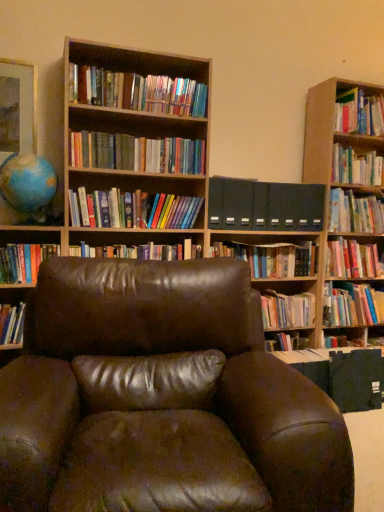
You are a GUI agent. You are given a task and a screenshot of the screen. Output one action in this format:
    pyautogui.click(x=<x>, y=<y>)
    Task: Click on the hardcover book at center, arranged as the fifth book when ordered from the bottom
    
    Given the screenshot: What is the action you would take?
    pyautogui.click(x=272, y=258)

Describe the element at coordinates (137, 92) in the screenshot. I see `hardcover books at upper center, the 12th book ordered from the bottom` at that location.

What is the approximate width of hardcover books at upper center, arranged as the second book when viewed from the top?

It is 8.76 inches.

How much space does hardcover books at center, marked as the 7th book in a bottom-to-top arrangement, occupy vertically?

hardcover books at center, marked as the 7th book in a bottom-to-top arrangement, is 6.47 inches in height.

What is the approximate width of hardcover books at center, marked as the 7th book in a bottom-to-top arrangement?

8.76 inches.

The height and width of the screenshot is (512, 384). What do you see at coordinates (265, 205) in the screenshot? I see `dark gray matte folder at center` at bounding box center [265, 205].

This screenshot has width=384, height=512. Identify the location of hardcover book at right, the sixth book in the bottom-to-top sequence. (352, 259).

From the image's perspective, is hardcover book at upper right, acting as the 5th book starting from the top, located above or below hardcover book at left, marked as the 10th book in a top-to-bottom arrangement?

Based on their image positions, hardcover book at upper right, acting as the 5th book starting from the top, is located above hardcover book at left, marked as the 10th book in a top-to-bottom arrangement.

From a real-world perspective, between hardcover book at upper right, acting as the 5th book starting from the top, and hardcover book at left, acting as the 4th book starting from the bottom, who is vertically higher?

From a 3D spatial view, hardcover book at upper right, acting as the 5th book starting from the top, is above.

Is hardcover book at upper right, acting as the 5th book starting from the top, placed right next to hardcover book at left, acting as the 4th book starting from the bottom?

They are not placed beside each other.

How many degrees apart are the facing directions of hardcover book at upper right, acting as the 5th book starting from the top, and hardcover book at left, acting as the 4th book starting from the bottom?

hardcover book at upper right, acting as the 5th book starting from the top, and hardcover book at left, acting as the 4th book starting from the bottom, are facing 0.248 degrees away from each other.

This screenshot has height=512, width=384. Find the location of `the 3rd book behind the hardcover books at upper center, the 12th book ordered from the bottom`. the 3rd book behind the hardcover books at upper center, the 12th book ordered from the bottom is located at coordinates (140, 251).

Is hardcover books at center, acting as the 7th book starting from the top, positioned in front of hardcover books at upper center, the 12th book ordered from the bottom?

No, hardcover books at center, acting as the 7th book starting from the top, is further to the viewer.

Between hardcover books at center, marked as the 7th book in a bottom-to-top arrangement, and hardcover books at upper center, the 12th book ordered from the bottom, which one has larger size?

hardcover books at upper center, the 12th book ordered from the bottom, is bigger.

Which is behind, point (364, 231) or point (1, 308)?

The point (364, 231) is farther from the camera.

Does hardcover book at upper right, the 9th book when ordered from bottom to top, appear on the right side of hardcover book at left, which is the 2th book in bottom-to-top order?

Indeed, hardcover book at upper right, the 9th book when ordered from bottom to top, is positioned on the right side of hardcover book at left, which is the 2th book in bottom-to-top order.

From a real-world perspective, who is located higher, hardcover book at upper right, acting as the 5th book starting from the top, or hardcover book at left, which is the 2th book in bottom-to-top order?

hardcover book at upper right, acting as the 5th book starting from the top, from a real-world perspective.

Is hardcover book at upper right, the 9th book when ordered from bottom to top, positioned far away from hardcover book at left, the twelfth book in the top-to-bottom sequence?

Absolutely, hardcover book at upper right, the 9th book when ordered from bottom to top, is distant from hardcover book at left, the twelfth book in the top-to-bottom sequence.

In terms of size, does dark gray matte folder at center appear bigger or smaller than hardcover book at left, marked as the 10th book in a top-to-bottom arrangement?

Clearly, dark gray matte folder at center is larger in size than hardcover book at left, marked as the 10th book in a top-to-bottom arrangement.

Is dark gray matte folder at center looking in the opposite direction of hardcover book at left, acting as the 4th book starting from the bottom?

dark gray matte folder at center is not turned away from hardcover book at left, acting as the 4th book starting from the bottom.

Considering the positions of objects dark gray matte folder at center and hardcover book at left, marked as the 10th book in a top-to-bottom arrangement, in the image provided, who is more to the left, dark gray matte folder at center or hardcover book at left, marked as the 10th book in a top-to-bottom arrangement,?

hardcover book at left, marked as the 10th book in a top-to-bottom arrangement.

Between dark gray matte folder at center and hardcover book at left, marked as the 10th book in a top-to-bottom arrangement, which one has larger width?

With larger width is hardcover book at left, marked as the 10th book in a top-to-bottom arrangement.

Is point (99, 149) farther from viewer compared to point (293, 251)?

No.

Based on the photo, is hardcover books at center, arranged as the 4th book when viewed from the top, aimed at hardcover book at center, marked as the ninth book in a top-to-bottom arrangement?

No, hardcover books at center, arranged as the 4th book when viewed from the top, does not turn towards hardcover book at center, marked as the ninth book in a top-to-bottom arrangement.

In the image, is hardcover books at center, the tenth book from the bottom, positioned in front of or behind hardcover book at center, arranged as the fifth book when ordered from the bottom?

hardcover books at center, the tenth book from the bottom, is positioned closer to the viewer than hardcover book at center, arranged as the fifth book when ordered from the bottom.

Is hardcover books at center, the tenth book from the bottom, to the left of hardcover book at center, marked as the ninth book in a top-to-bottom arrangement, from the viewer's perspective?

Yes, hardcover books at center, the tenth book from the bottom, is to the left of hardcover book at center, marked as the ninth book in a top-to-bottom arrangement.

Is hardcover book at left, the twelfth book in the top-to-bottom sequence, inside or outside of hardcover book at center, arranged as the 1th book when ordered from the bottom?

hardcover book at left, the twelfth book in the top-to-bottom sequence, is outside hardcover book at center, arranged as the 1th book when ordered from the bottom.

Based on the photo, between hardcover book at left, the twelfth book in the top-to-bottom sequence, and hardcover book at center, the thirteenth book positioned from the top, which one is positioned in front?

hardcover book at left, the twelfth book in the top-to-bottom sequence.

How many degrees apart are the facing directions of hardcover book at left, the twelfth book in the top-to-bottom sequence, and hardcover book at center, arranged as the 1th book when ordered from the bottom?

There is a 0.614-degree angle between the facing directions of hardcover book at left, the twelfth book in the top-to-bottom sequence, and hardcover book at center, arranged as the 1th book when ordered from the bottom.

Considering the relative sizes of hardcover book at left, the twelfth book in the top-to-bottom sequence, and hardcover book at center, the thirteenth book positioned from the top, in the image provided, is hardcover book at left, the twelfth book in the top-to-bottom sequence, shorter than hardcover book at center, the thirteenth book positioned from the top,?

No, hardcover book at left, the twelfth book in the top-to-bottom sequence, is not shorter than hardcover book at center, the thirteenth book positioned from the top.

Is dark gray matte folder at center next to hardcover book at upper right, the 11th book positioned from the bottom?

No, dark gray matte folder at center is not beside hardcover book at upper right, the 11th book positioned from the bottom.

Between dark gray matte folder at center and hardcover book at upper right, the 11th book positioned from the bottom, which one has more height?

With more height is dark gray matte folder at center.

Considering the positions of objects dark gray matte folder at center and hardcover book at upper right, the 3th book from the top, in the image provided, who is behind, dark gray matte folder at center or hardcover book at upper right, the 3th book from the top,?

hardcover book at upper right, the 3th book from the top.

Considering the relative sizes of dark gray matte folder at center and hardcover book at upper right, the 3th book from the top, in the image provided, is dark gray matte folder at center wider than hardcover book at upper right, the 3th book from the top,?

In fact, dark gray matte folder at center might be narrower than hardcover book at upper right, the 3th book from the top.

Where is `book that is the 9th object located in front of the hardcover book at upper right, acting as the 5th book starting from the top`? The width and height of the screenshot is (384, 512). book that is the 9th object located in front of the hardcover book at upper right, acting as the 5th book starting from the top is located at coordinates (24, 262).

From a real-world perspective, starting from the hardcover books at upper center, the 12th book ordered from the bottom, which book is the 5th one below it? Please provide its 2D coordinates.

[(140, 251)]

Which object lies further to the anchor point hardcover book at upper right, positioned as the first book in top-to-bottom order, hardcover books at center, the sixth book in the top-to-bottom sequence, or hardcover books at upper center, the 12th book ordered from the bottom?

The object further to hardcover book at upper right, positioned as the first book in top-to-bottom order, is hardcover books at center, the sixth book in the top-to-bottom sequence.

When comparing their distances from hardcover book at left, acting as the 4th book starting from the bottom, does hardcover books at upper center, the 12th book ordered from the bottom, or hardcover book at upper right, the 9th book when ordered from bottom to top, seem closer?

Based on the image, hardcover books at upper center, the 12th book ordered from the bottom, appears to be nearer to hardcover book at left, acting as the 4th book starting from the bottom.

Based on their spatial positions, is hardcover book at right, marked as the eighth book in a top-to-bottom arrangement, or hardcover book at upper right, which is counted as the 13th book, starting from the bottom, further from hardcover books at center, arranged as the 4th book when viewed from the top?

Among the two, hardcover book at right, marked as the eighth book in a top-to-bottom arrangement, is located further to hardcover books at center, arranged as the 4th book when viewed from the top.

Looking at the image, which one is located further to hardcover book at upper right, the 3th book from the top, hardcover book at right, the sixth book in the bottom-to-top sequence, or dark gray matte folder at center?

hardcover book at right, the sixth book in the bottom-to-top sequence.

Estimate the real-world distances between objects in this image. Which object is closer to hardcover book at upper right, the 11th book positioned from the bottom, hardcover books at center, arranged as the 4th book when viewed from the top, or brown leather chair at center?

Based on the image, hardcover books at center, arranged as the 4th book when viewed from the top, appears to be nearer to hardcover book at upper right, the 11th book positioned from the bottom.

Estimate the real-world distances between objects in this image. Which object is closer to hardcover book at upper right, the 9th book when ordered from bottom to top, hardcover book at center, positioned as the 3th book in bottom-to-top order, or hardcover book at left, acting as the 4th book starting from the bottom?

Among the two, hardcover book at center, positioned as the 3th book in bottom-to-top order, is located nearer to hardcover book at upper right, the 9th book when ordered from bottom to top.

Which object lies further to the anchor point hardcover books at center, marked as the 7th book in a bottom-to-top arrangement, hardcover book at upper right, acting as the 5th book starting from the top, or hardcover book at left, acting as the 4th book starting from the bottom?

hardcover book at upper right, acting as the 5th book starting from the top, is positioned further to the anchor hardcover books at center, marked as the 7th book in a bottom-to-top arrangement.

From the image, which object appears to be nearer to hardcover books at center, acting as the 7th book starting from the top, hardcover books at upper center, the 12th book ordered from the bottom, or hardcover books at center, arranged as the 4th book when viewed from the top?

hardcover books at center, arranged as the 4th book when viewed from the top.

Locate an element on the screen. The width and height of the screenshot is (384, 512). bookcase between hardcover book at left, acting as the 4th book starting from the bottom, and hardcover book at upper right, positioned as the first book in top-to-bottom order, from left to right is located at coordinates (208, 169).

In order to click on bookcase that lies between hardcover book at upper right, the 11th book positioned from the bottom, and hardcover book at center, the thirteenth book positioned from the top, from top to bottom in this screenshot , I will do `click(208, 169)`.

Where is `bookcase between hardcover books at upper center, the 12th book ordered from the bottom, and hardcover book at center, arranged as the fifth book when ordered from the bottom, vertically`? The image size is (384, 512). bookcase between hardcover books at upper center, the 12th book ordered from the bottom, and hardcover book at center, arranged as the fifth book when ordered from the bottom, vertically is located at coordinates (208, 169).

Locate an element on the screen. The image size is (384, 512). chair located between matte gold picture frame at upper left and hardcover book at right, marked as the eighth book in a top-to-bottom arrangement, in the left-right direction is located at coordinates (162, 399).